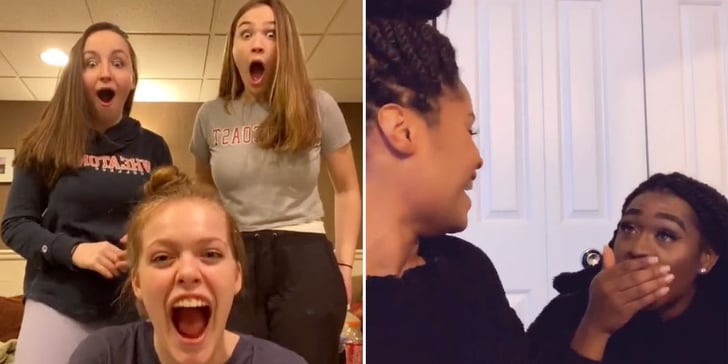
Locate an element on the screen. Image resolution: width=728 pixels, height=364 pixels. brown wall is located at coordinates (25, 116).